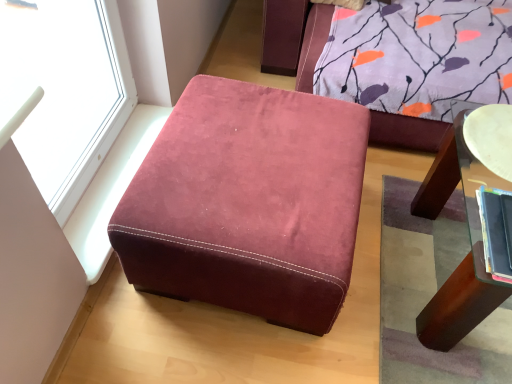
Locate an element on the screen. The height and width of the screenshot is (384, 512). vacant area located to the right-hand side of suede-like burgundy ottoman at center is located at coordinates (405, 254).